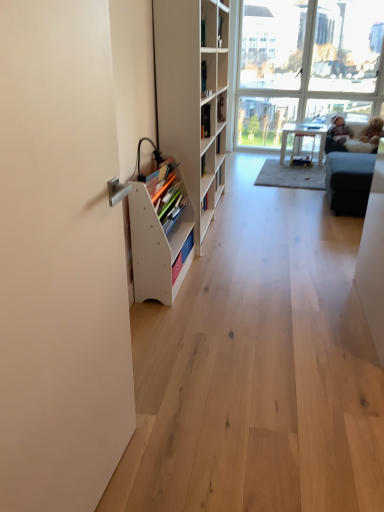
Question: Based on their sizes in the image, would you say hardcover book at upper center, acting as the first book starting from the back, is bigger or smaller than transparent glass window at upper right?

Choices:
 (A) big
 (B) small

Answer: (B)

Question: Is hardcover book at upper center, the second book in the front-to-back sequence, situated inside transparent glass window at upper right or outside?

Choices:
 (A) outside
 (B) inside

Answer: (A)

Question: Based on their relative distances, which object is farther from the white matte bookshelf at left, the 1th shelf in the top-to-bottom sequence?

Choices:
 (A) light brown plush toy at upper right
 (B) dark gray fabric couch at upper right
 (C) white plastic book at left, acting as the 1th book starting from the left
 (D) transparent glass window at upper right
 (E) white wood bookshelf at left, which is the 2th shelf in top-to-bottom order

Answer: (A)

Question: Which of these objects is positioned farthest from the hardcover book at upper center, the first book from the right?

Choices:
 (A) transparent glass window at upper right
 (B) light brown plush toy at upper right
 (C) white plastic book at left, the 2th book in the back-to-front sequence
 (D) white wood bookshelf at left, the first shelf in the bottom-to-top sequence
 (E) white glossy table at center

Answer: (A)